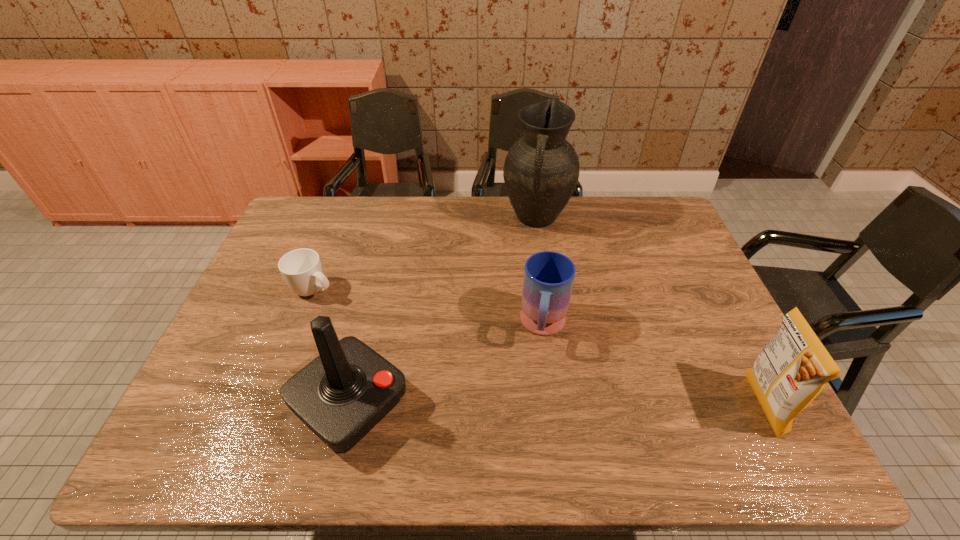
Find the location of a particular element. The image size is (960, 540). joystick is located at coordinates point(341,395).

The image size is (960, 540). I want to click on the rightmost object, so coord(792,369).

This screenshot has width=960, height=540. Find the location of `the third shortest object`. the third shortest object is located at coordinates (792, 369).

Where is `the fourth tallest object`? the fourth tallest object is located at coordinates point(549,276).

The image size is (960, 540). Identify the location of the shortest object. (301, 268).

I want to click on pitcher, so click(541, 170).

The width and height of the screenshot is (960, 540). What are the coordinates of `the tallest object` in the screenshot? It's located at (541, 170).

You are a GUI agent. You are given a task and a screenshot of the screen. Output one action in this format:
    pyautogui.click(x=<x>, y=<y>)
    Task: Click on the free space located on the back of the joystick
    Image resolution: width=960 pixels, height=540 pixels.
    Given the screenshot: What is the action you would take?
    pyautogui.click(x=372, y=312)

Identify the location of vacant space located on the side of the second shortest object with the handle. (536, 399).

Where is `free space located with the handle on the side of the cup`? free space located with the handle on the side of the cup is located at coordinates (389, 328).